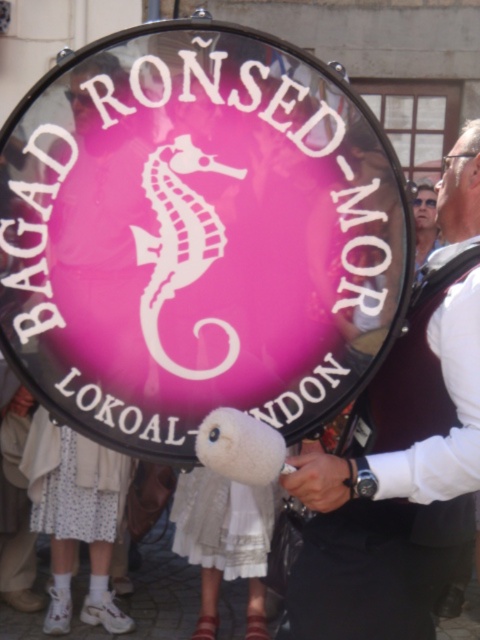
Does white fabric vest at center have a smaller size compared to white fluffy animal at center?

Incorrect, white fabric vest at center is not smaller in size than white fluffy animal at center.

Is white fabric vest at center to the left of white fluffy animal at center from the viewer's perspective?

No, white fabric vest at center is not to the left of white fluffy animal at center.

I want to click on white fabric vest at center, so click(403, 454).

Consider the image. Is pink glossy drum at center smaller than white fluffy animal at center?

No.

Which is behind, point (319, 99) or point (248, 445)?

The point (319, 99) is more distant.

At what (x,y) coordinates should I click in order to perform the action: click on pink glossy drum at center. Please return your answer as a coordinate pair (x, y). The height and width of the screenshot is (640, 480). Looking at the image, I should click on (196, 236).

Between white plastic seahorse at center and white fluffy animal at center, which one appears on the left side from the viewer's perspective?

white plastic seahorse at center

Consider the image. Is white plastic seahorse at center bigger than white fluffy animal at center?

No.

In order to click on white plastic seahorse at center in this screenshot , I will do `click(180, 248)`.

Locate an element on the screen. white plastic seahorse at center is located at coordinates (180, 248).